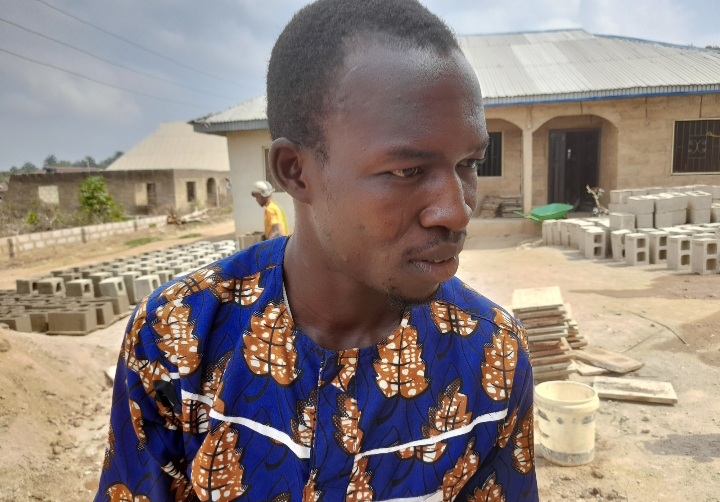
The image size is (720, 502). I want to click on tiles, so click(540, 301), click(548, 330), click(620, 347).